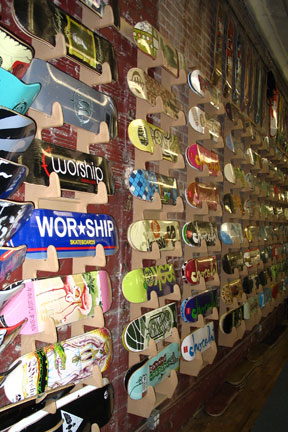
Locate an element on the screen. ceiling is located at coordinates (279, 9), (284, 29).